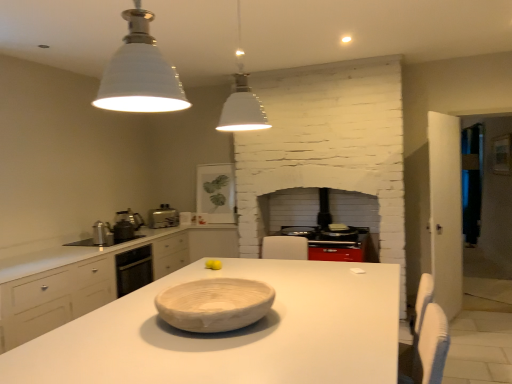
Locate an element on the screen. free space above white matte countertop at center (from a real-world perspective) is located at coordinates (263, 324).